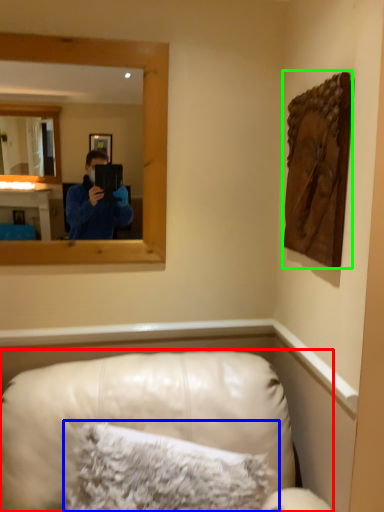
Question: Estimate the real-world distances between objects in this image. Which object is farther from furniture (highlighted by a red box), pillow (highlighted by a blue box) or picture frame (highlighted by a green box)?

Choices:
 (A) pillow
 (B) picture frame

Answer: (B)